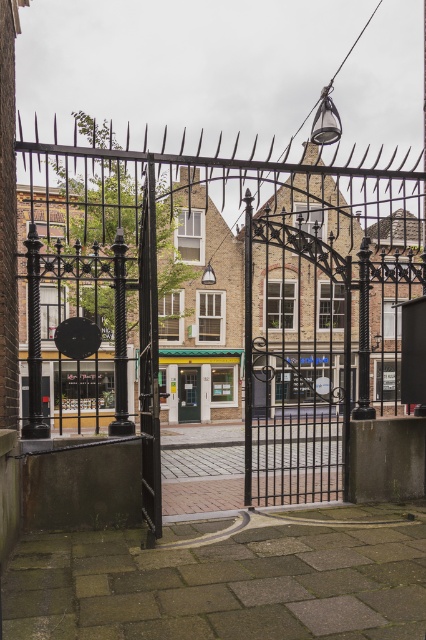
Question: Which of the following is the closest to the observer?

Choices:
 (A) (181, 392)
 (B) (152, 396)

Answer: (B)

Question: From the image, what is the correct spatial relationship of black wrought iron gate at center in relation to metallic door at center?

Choices:
 (A) left
 (B) right

Answer: (A)

Question: Is black wrought iron gate at center to the right of metallic door at center from the viewer's perspective?

Choices:
 (A) yes
 (B) no

Answer: (B)

Question: Does black wrought iron gate at center appear under metallic door at center?

Choices:
 (A) yes
 (B) no

Answer: (B)